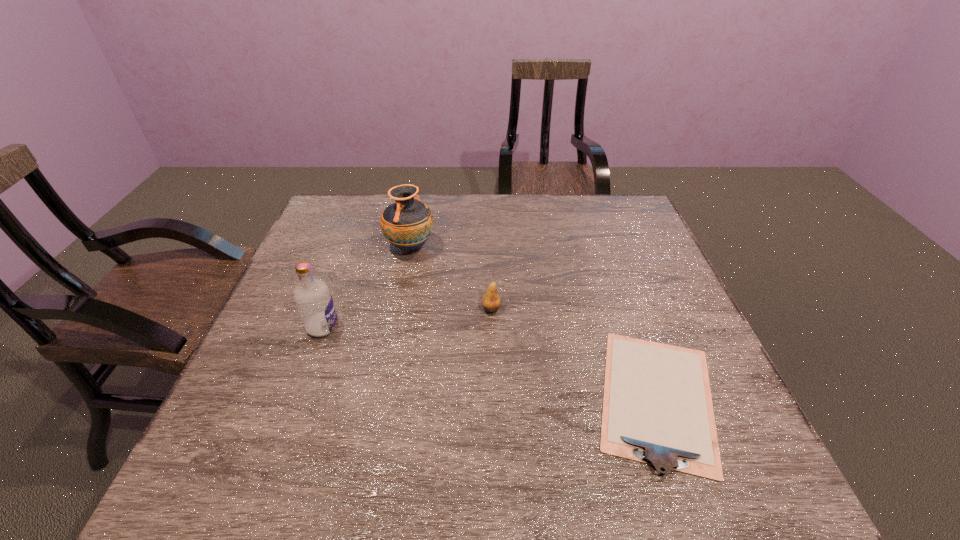
You are a GUI agent. You are given a task and a screenshot of the screen. Output one action in this format:
    pyautogui.click(x=<x>, y=<y>)
    Task: Click on the vacant region at the far left corner
    The width and height of the screenshot is (960, 540).
    Given the screenshot: What is the action you would take?
    pyautogui.click(x=348, y=202)

You are a GUI agent. You are given a task and a screenshot of the screen. Output one action in this format:
    pyautogui.click(x=<x>, y=<y>)
    Task: Click on the free space at the far right corner of the desktop
    
    Given the screenshot: What is the action you would take?
    pyautogui.click(x=588, y=198)

This screenshot has width=960, height=540. I want to click on free space that is in between the pottery and the shortest object, so click(534, 322).

This screenshot has width=960, height=540. Find the location of `free spot between the leftmost object and the pottery`. free spot between the leftmost object and the pottery is located at coordinates (367, 287).

Find the location of a particular element. This screenshot has width=960, height=540. free spot between the second object from left to right and the clipboard is located at coordinates (534, 322).

In order to click on free space between the second object from right to left and the shortest object in this screenshot , I will do `click(574, 353)`.

This screenshot has height=540, width=960. Find the location of `free area in between the leftmost object and the rightmost object`. free area in between the leftmost object and the rightmost object is located at coordinates (490, 362).

The image size is (960, 540). Find the location of `empty space between the shortest object and the farthest object`. empty space between the shortest object and the farthest object is located at coordinates (534, 322).

I want to click on unoccupied area between the vodka and the second shortest object, so click(407, 318).

This screenshot has width=960, height=540. What are the coordinates of `blank region between the leftmost object and the third tallest object` in the screenshot? It's located at (407, 318).